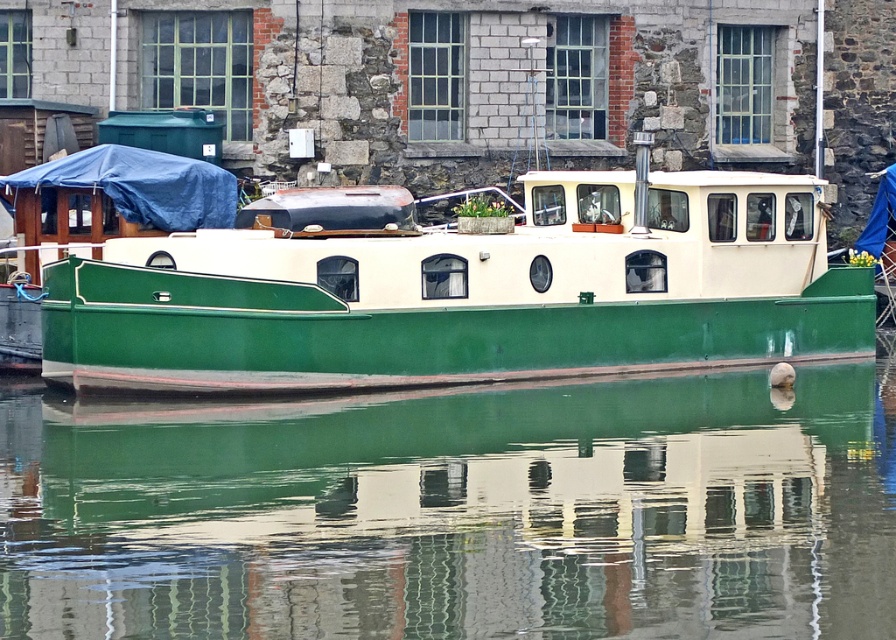
Question: Which of the following is the closest to the observer?

Choices:
 (A) green matte boat at center
 (B) green smooth water at center

Answer: (B)

Question: Is green smooth water at center wider than green matte boat at center?

Choices:
 (A) yes
 (B) no

Answer: (A)

Question: Can you confirm if green smooth water at center is positioned to the left of green matte boat at center?

Choices:
 (A) yes
 (B) no

Answer: (A)

Question: Which object appears farthest from the camera in this image?

Choices:
 (A) green smooth water at center
 (B) green matte boat at center

Answer: (B)

Question: Which object appears farthest from the camera in this image?

Choices:
 (A) green smooth water at center
 (B) green matte boat at center

Answer: (B)

Question: Is green smooth water at center bigger than green matte boat at center?

Choices:
 (A) no
 (B) yes

Answer: (B)